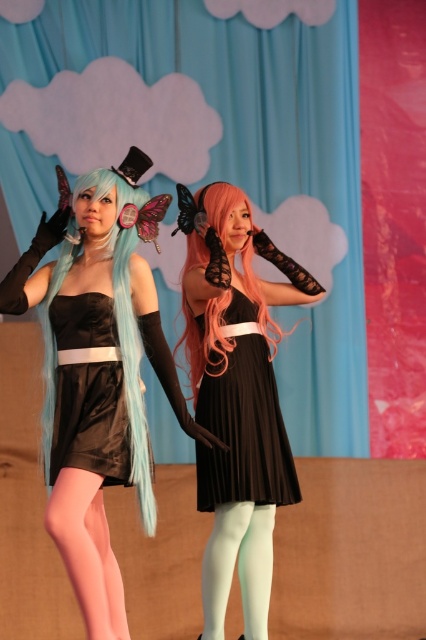
Is black pleated dress at center behind pink silky hair at center?

No, black pleated dress at center is in front of pink silky hair at center.

Between black pleated dress at center and pink silky hair at center, which one is positioned higher?

pink silky hair at center

Does point (259, 426) come in front of point (192, 259)?

Yes, it is in front of point (192, 259).

Find the location of a particular element. This screenshot has width=426, height=640. black pleated dress at center is located at coordinates [x=242, y=429].

Is point (207, 401) behind point (92, 621)?

Yes, point (207, 401) is behind point (92, 621).

Does black pleated dress at center have a greater height compared to pink satin tights at lower left?

Yes.

What do you see at coordinates (242, 429) in the screenshot? Image resolution: width=426 pixels, height=640 pixels. I see `black pleated dress at center` at bounding box center [242, 429].

Where is `black pleated dress at center`? black pleated dress at center is located at coordinates (242, 429).

Is point (60, 490) positioned behind point (259, 620)?

No, it is in front of (259, 620).

Locate an element on the screen. Image resolution: width=426 pixels, height=640 pixels. pink satin tights at lower left is located at coordinates point(88,552).